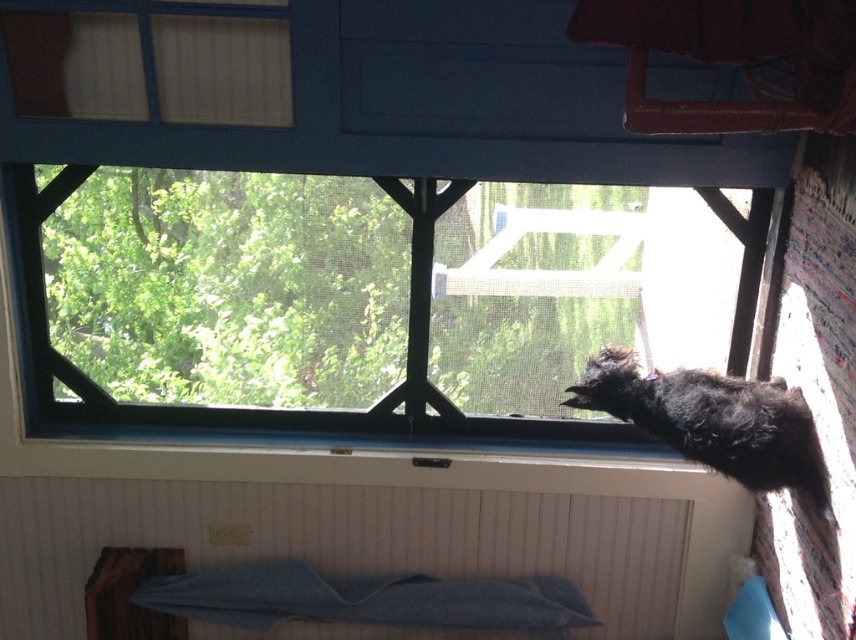
Question: Is clear glass window at center positioned behind blue painted radiator at lower left?

Choices:
 (A) no
 (B) yes

Answer: (A)

Question: Which point is closer to the camera?

Choices:
 (A) clear glass window at center
 (B) blue painted radiator at lower left

Answer: (A)

Question: Which object appears farthest from the camera in this image?

Choices:
 (A) blue painted radiator at lower left
 (B) clear glass window at center

Answer: (A)

Question: Can you confirm if clear glass window at center is wider than blue painted radiator at lower left?

Choices:
 (A) no
 (B) yes

Answer: (A)

Question: From the image, what is the correct spatial relationship of clear glass window at center in relation to blue painted radiator at lower left?

Choices:
 (A) above
 (B) below

Answer: (A)